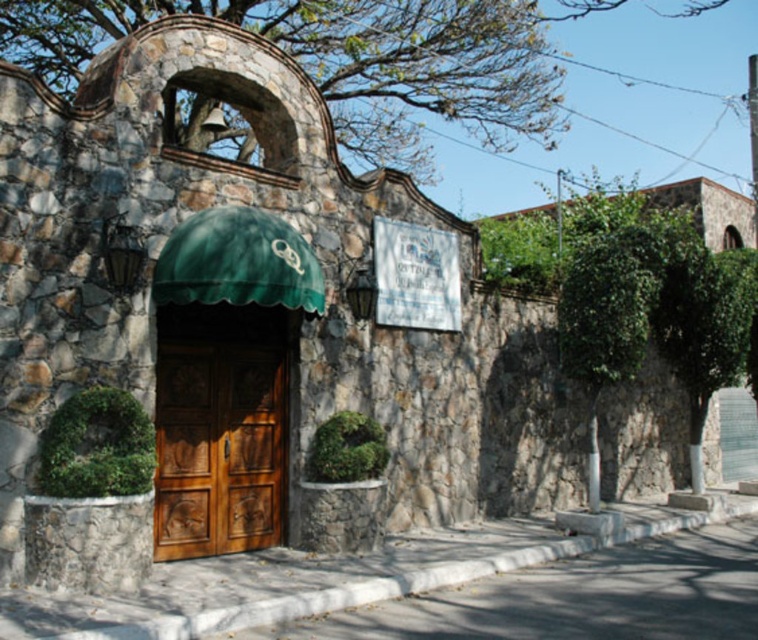
In the scene shown: Measure the distance between green leafy tree at upper center and wooden door at center.

They are 24.17 feet apart.

Between green leafy tree at upper center and wooden door at center, which one has less height?

Standing shorter between the two is wooden door at center.

This screenshot has height=640, width=758. What do you see at coordinates (359, 61) in the screenshot?
I see `green leafy tree at upper center` at bounding box center [359, 61].

Find the location of a particular element. green leafy tree at upper center is located at coordinates (359, 61).